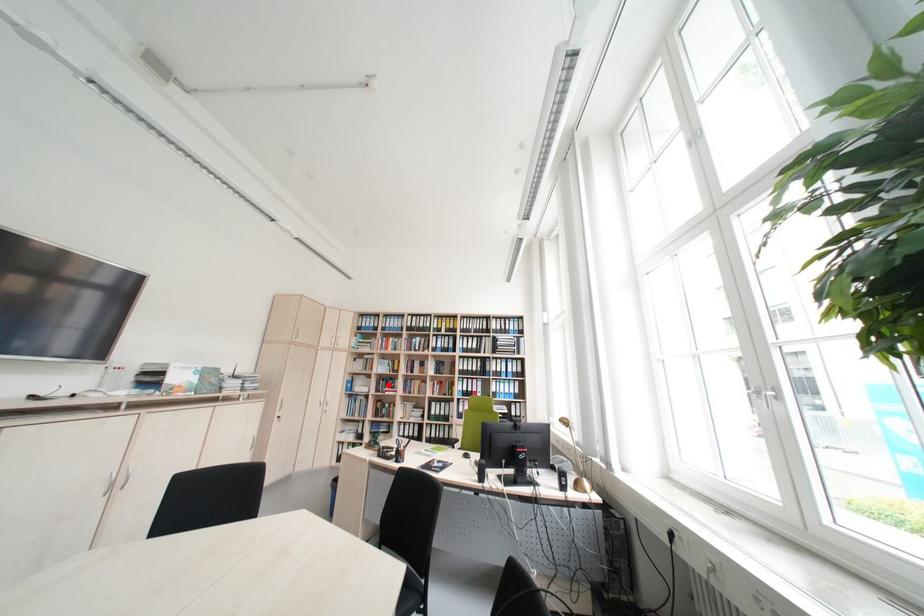
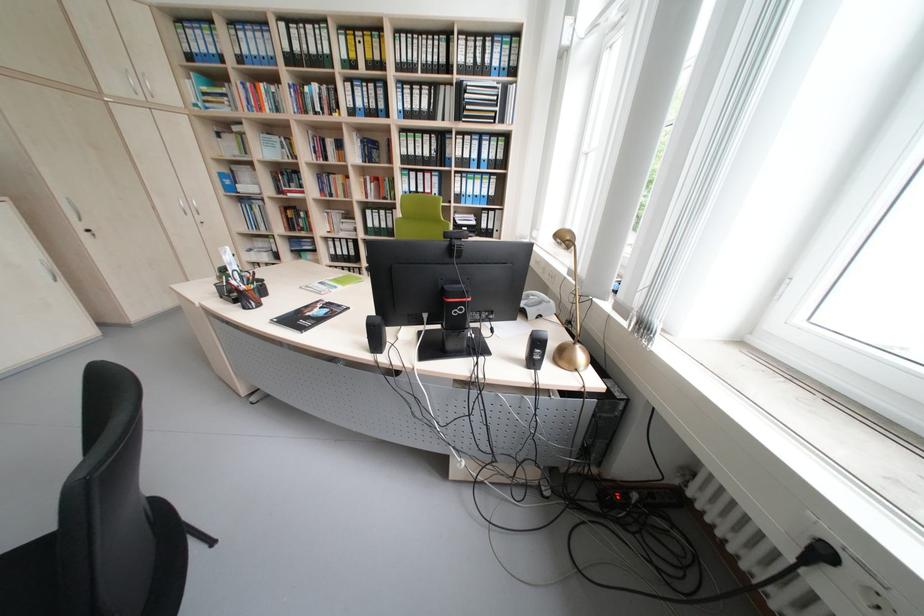
Question: I am providing you with two images of the same scene from different viewpoints. Image1 has a red point marked. In image2, the corresponding 3D location appears at what relative position? Reply with the corresponding letter.

Choices:
 (A) Closer
 (B) Farther

Answer: (A)